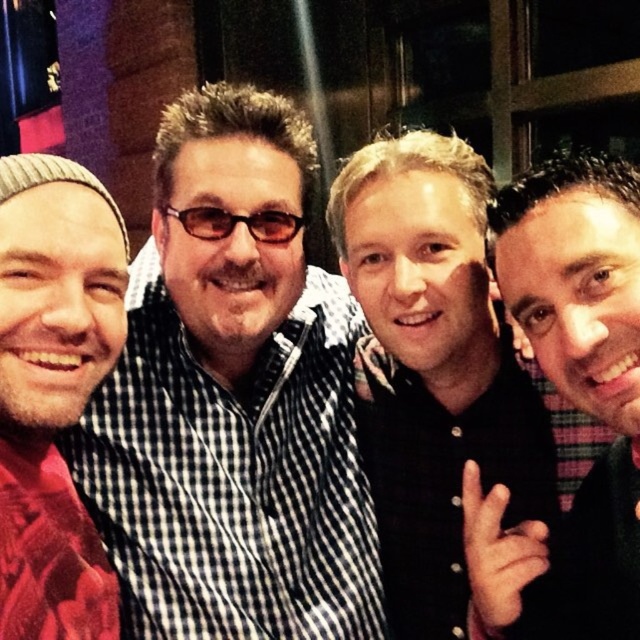
In the scene shown: Can you confirm if checkered fabric shirt at center is shorter than black button-up shirt at right?

No, checkered fabric shirt at center is not shorter than black button-up shirt at right.

Is point (220, 360) farther from camera compared to point (513, 577)?

Yes, it is behind point (513, 577).

The height and width of the screenshot is (640, 640). Describe the element at coordinates (232, 397) in the screenshot. I see `checkered fabric shirt at center` at that location.

I want to click on checkered fabric shirt at center, so click(x=232, y=397).

Does checkered fabric shirt at center have a lesser height compared to red plaid shirt at left?

In fact, checkered fabric shirt at center may be taller than red plaid shirt at left.

Can you confirm if checkered fabric shirt at center is smaller than red plaid shirt at left?

Incorrect, checkered fabric shirt at center is not smaller in size than red plaid shirt at left.

You are a GUI agent. You are given a task and a screenshot of the screen. Output one action in this format:
    pyautogui.click(x=<x>, y=<y>)
    Task: Click on the checkered fabric shirt at center
    
    Given the screenshot: What is the action you would take?
    pyautogui.click(x=232, y=397)

Locate an element on the screen. checkered fabric shirt at center is located at coordinates (232, 397).

Which is more to the left, black matte shirt at center or red plaid shirt at left?

From the viewer's perspective, red plaid shirt at left appears more on the left side.

Does point (444, 397) come closer to viewer compared to point (51, 316)?

That is False.

Identify the location of black matte shirt at center. pos(433,369).